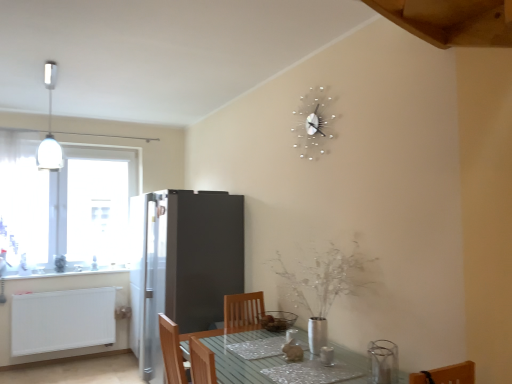
Question: Relative to white glossy light fixture at upper left, is satin silver refrigerator at center-left in front or behind?

Choices:
 (A) front
 (B) behind

Answer: (B)

Question: From the image's perspective, is satin silver refrigerator at center-left positioned above or below white glossy light fixture at upper left?

Choices:
 (A) above
 (B) below

Answer: (B)

Question: Which of these objects is positioned farthest from the matte glass bowl at center?

Choices:
 (A) white glossy light fixture at upper left
 (B) wooden chair at lower center
 (C) white matte radiator at lower left
 (D) white glossy counter top at left
 (E) transparent glass window at left

Answer: (E)

Question: Which object is the farthest from the white glossy counter top at left?

Choices:
 (A) silver metallic clock at upper center
 (B) white glossy light fixture at upper left
 (C) clear glass table at lower center
 (D) white matte radiator at lower left
 (E) wooden at upper right

Answer: (E)